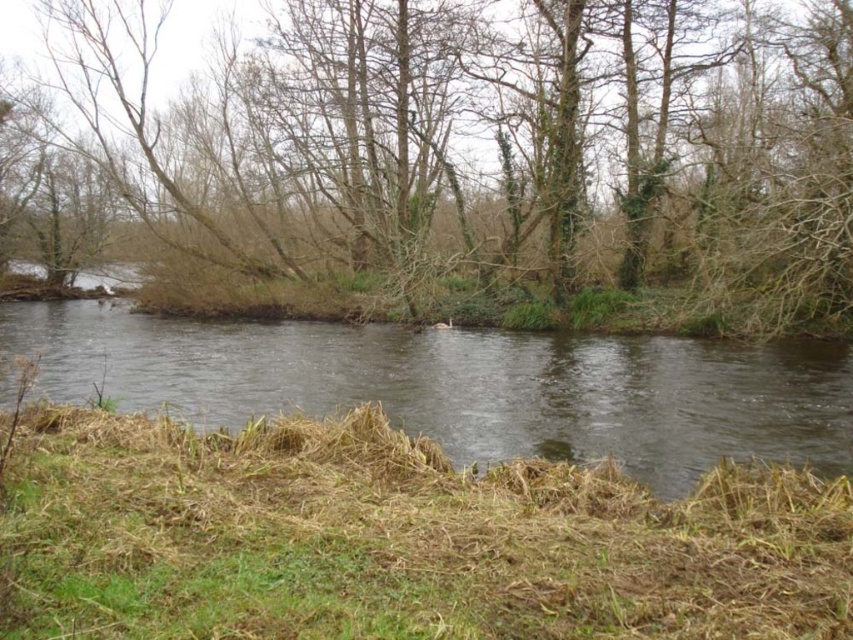
Question: Considering the relative positions of brown leafless tree at center and clear water at center in the image provided, where is brown leafless tree at center located with respect to clear water at center?

Choices:
 (A) above
 (B) below

Answer: (A)

Question: From the image, what is the correct spatial relationship of brown leafless tree at center in relation to brown dry grass at lower center?

Choices:
 (A) above
 (B) below

Answer: (A)

Question: Which object is the farthest from the brown dry grass at lower center?

Choices:
 (A) brown leafless tree at center
 (B) clear water at center

Answer: (A)

Question: Which is farther from the brown leafless tree at center?

Choices:
 (A) brown dry grass at lower center
 (B) clear water at center

Answer: (A)

Question: Estimate the real-world distances between objects in this image. Which object is farther from the clear water at center?

Choices:
 (A) brown leafless tree at center
 (B) brown dry grass at lower center

Answer: (B)

Question: Does brown dry grass at lower center have a smaller size compared to clear water at center?

Choices:
 (A) no
 (B) yes

Answer: (B)